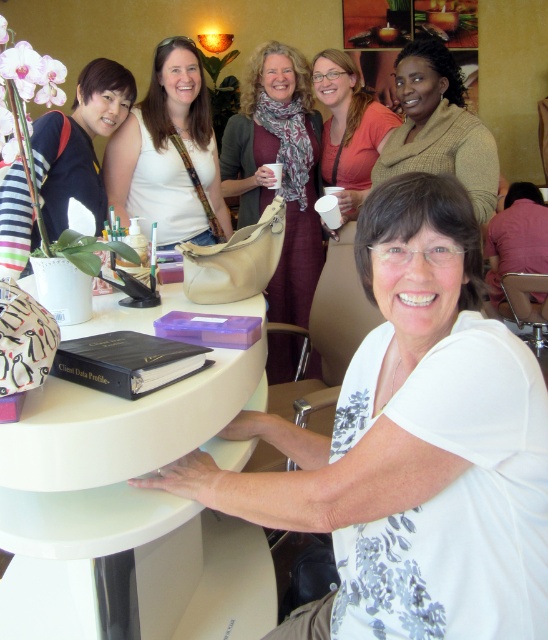
Is white floral shirt at center behind matte white mug at upper center?

No, it is not.

Can you confirm if white floral shirt at center is positioned below matte white mug at upper center?

Indeed, white floral shirt at center is positioned under matte white mug at upper center.

Describe the element at coordinates (412, 445) in the screenshot. The height and width of the screenshot is (640, 548). I see `white floral shirt at center` at that location.

Where is `white floral shirt at center`? This screenshot has height=640, width=548. white floral shirt at center is located at coordinates (412, 445).

Who is shorter, matte white purse at upper center or brown wool sweater at upper right?

brown wool sweater at upper right

Does matte white purse at upper center appear on the left side of brown wool sweater at upper right?

Indeed, matte white purse at upper center is positioned on the left side of brown wool sweater at upper right.

Is point (111, 195) positioned in front of point (453, 144)?

No, (111, 195) is further to viewer.

At what (x,y) coordinates should I click in order to perform the action: click on matte white purse at upper center. Please return your answer as a coordinate pair (x, y). This screenshot has height=640, width=548. Looking at the image, I should click on (169, 152).

Between point (286, 128) and point (426, 138), which one is positioned behind?

Positioned behind is point (286, 128).

Is matte brown scarf at center wider than brown wool sweater at upper right?

Indeed, matte brown scarf at center has a greater width compared to brown wool sweater at upper right.

Between point (271, 48) and point (461, 113), which one is positioned in front?

Point (461, 113) is in front.

Locate an element on the screen. This screenshot has width=548, height=640. matte brown scarf at center is located at coordinates (282, 170).